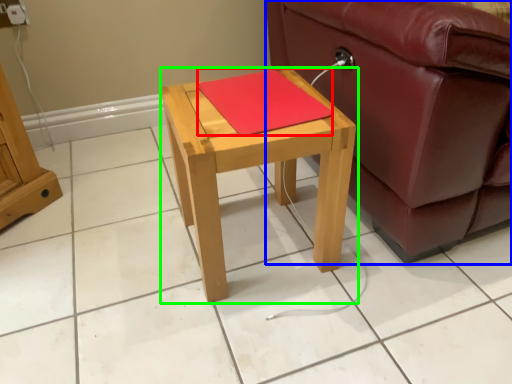
Question: Which object is positioned farthest from pad (highlighted by a red box)? Select from studio couch (highlighted by a blue box) and table (highlighted by a green box).

Choices:
 (A) studio couch
 (B) table

Answer: (A)